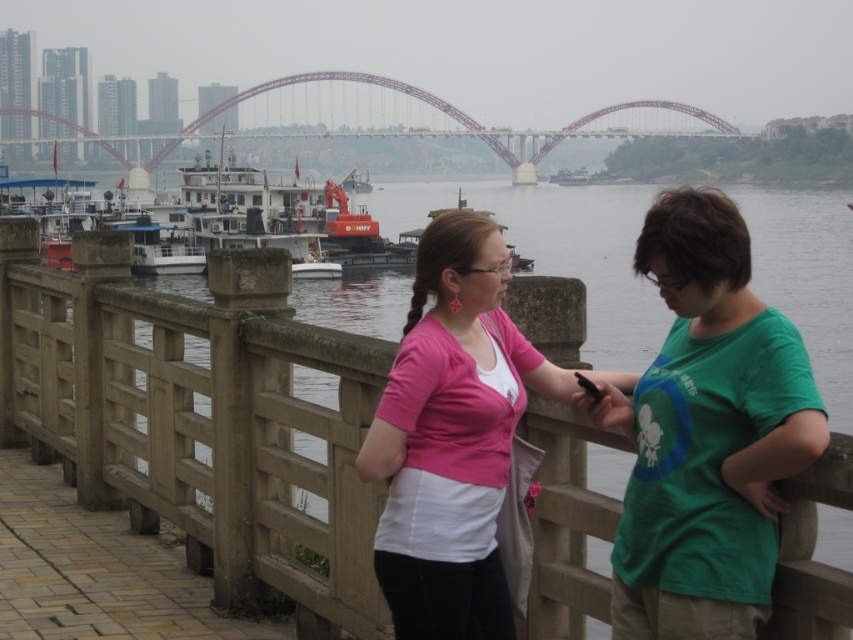
Question: Which of the following is the farthest from the observer?

Choices:
 (A) metallic bridge at upper center
 (B) pink fabric shirt at center

Answer: (A)

Question: Considering the relative positions of pink fabric shirt at center and metallic bridge at upper center in the image provided, where is pink fabric shirt at center located with respect to metallic bridge at upper center?

Choices:
 (A) right
 (B) left

Answer: (A)

Question: Which point appears closest to the camera in this image?

Choices:
 (A) (392, 481)
 (B) (253, 552)

Answer: (A)

Question: Which object is positioned farthest from the green cotton shirt at right?

Choices:
 (A) brown wooden rail at center
 (B) metallic bridge at upper center

Answer: (B)

Question: Is brown wooden rail at center above pink fabric shirt at center?

Choices:
 (A) no
 (B) yes

Answer: (B)

Question: In this image, where is green cotton shirt at right located relative to metallic bridge at upper center?

Choices:
 (A) right
 (B) left

Answer: (A)